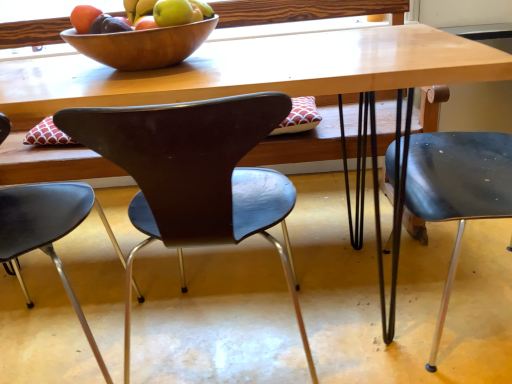
Locate an element on the screen. This screenshot has height=384, width=512. wooden bowl at upper center is located at coordinates click(142, 45).

Describe the element at coordinates (458, 189) in the screenshot. I see `matte black chair at right, acting as the 1th chair starting from the right` at that location.

The image size is (512, 384). In order to click on matte brown chair at center, marked as the 2th chair in a left-to-right arrangement in this screenshot , I will do `click(194, 175)`.

Looking at their sizes, would you say matte brown chair at center, the 2th chair in the right-to-left sequence, is wider or thinner than matte black chair at right, acting as the 1th chair starting from the right?

Clearly, matte brown chair at center, the 2th chair in the right-to-left sequence, has less width compared to matte black chair at right, acting as the 1th chair starting from the right.

Is point (126, 360) more distant than point (428, 137)?

No.

Starting from the matte black chair at right, the 3th chair from the left, which chair is the 1st one in front? Please provide its 2D coordinates.

[(194, 175)]

Is wooden bowl at upper center outside of matte black chair at center, the first chair in the left-to-right sequence?

That's correct, wooden bowl at upper center is outside of matte black chair at center, the first chair in the left-to-right sequence.

Who is bigger, wooden bowl at upper center or matte black chair at center, placed as the 3th chair when sorted from right to left?

matte black chair at center, placed as the 3th chair when sorted from right to left, is bigger.

Is the position of wooden bowl at upper center less distant than that of matte black chair at center, the first chair in the left-to-right sequence?

No, wooden bowl at upper center is further to the viewer.

Which is closer to the camera, (128, 55) or (62, 227)?

Clearly, point (128, 55) is closer to the camera than point (62, 227).

From the image's perspective, which chair is the 2nd one below the matte black chair at right, acting as the 1th chair starting from the right? Please provide its 2D coordinates.

[(48, 232)]

Does point (77, 201) appear closer or farther from the camera than point (419, 176)?

Point (77, 201) appears to be closer to the viewer than point (419, 176).

Based on the photo, considering the positions of objects matte black chair at center, the first chair in the left-to-right sequence, and matte black chair at right, acting as the 1th chair starting from the right, in the image provided, who is more to the right, matte black chair at center, the first chair in the left-to-right sequence, or matte black chair at right, acting as the 1th chair starting from the right,?

matte black chair at right, acting as the 1th chair starting from the right.

Considering the sizes of objects matte black chair at center, the first chair in the left-to-right sequence, and matte black chair at right, the 3th chair from the left, in the image provided, who is wider, matte black chair at center, the first chair in the left-to-right sequence, or matte black chair at right, the 3th chair from the left,?

matte black chair at right, the 3th chair from the left, is wider.

From the picture: Is matte brown chair at center, marked as the 2th chair in a left-to-right arrangement, looking in the opposite direction of wooden bowl at upper center?

No.

What's the angular difference between matte brown chair at center, the 2th chair in the right-to-left sequence, and wooden bowl at upper center's facing directions?

matte brown chair at center, the 2th chair in the right-to-left sequence, and wooden bowl at upper center are facing 176 degrees away from each other.

From the image's perspective, which is above, matte brown chair at center, the 2th chair in the right-to-left sequence, or wooden bowl at upper center?

wooden bowl at upper center is shown above in the image.

Is matte brown chair at center, the 2th chair in the right-to-left sequence, far away from wooden bowl at upper center?

matte brown chair at center, the 2th chair in the right-to-left sequence, is actually quite close to wooden bowl at upper center.

From the image's perspective, is matte black chair at center, the first chair in the left-to-right sequence, beneath wooden bowl at upper center?

Yes, from the image's perspective, matte black chair at center, the first chair in the left-to-right sequence, is beneath wooden bowl at upper center.

Based on the photo, is matte black chair at center, the first chair in the left-to-right sequence, oriented away from wooden bowl at upper center?

That's not correct — matte black chair at center, the first chair in the left-to-right sequence, is not looking away from wooden bowl at upper center.

Where is `bowl above the matte black chair at center, the first chair in the left-to-right sequence (from the image's perspective)`? bowl above the matte black chair at center, the first chair in the left-to-right sequence (from the image's perspective) is located at coordinates (x=142, y=45).

What's the angular difference between matte black chair at center, the first chair in the left-to-right sequence, and wooden bowl at upper center's facing directions?

176 degrees separate the facing orientations of matte black chair at center, the first chair in the left-to-right sequence, and wooden bowl at upper center.

Based on the photo, could you tell me if matte black chair at right, the 3th chair from the left, is turned towards matte black chair at center, placed as the 3th chair when sorted from right to left?

Yes, matte black chair at right, the 3th chair from the left, is turned towards matte black chair at center, placed as the 3th chair when sorted from right to left.

Is matte black chair at center, placed as the 3th chair when sorted from right to left, completely or partially inside matte black chair at right, acting as the 1th chair starting from the right?

No, matte black chair at center, placed as the 3th chair when sorted from right to left, is located outside of matte black chair at right, acting as the 1th chair starting from the right.

Looking at their sizes, would you say matte black chair at right, the 3th chair from the left, is wider or thinner than matte black chair at center, the first chair in the left-to-right sequence?

Considering their sizes, matte black chair at right, the 3th chair from the left, looks broader than matte black chair at center, the first chair in the left-to-right sequence.

From the image's perspective, between wooden bowl at upper center and matte black chair at right, the 3th chair from the left, who is located below?

matte black chair at right, the 3th chair from the left.

From the wooden bowl at upper center, count 2nd chair to the right and point to it. Please provide its 2D coordinates.

[(458, 189)]

Is wooden bowl at upper center behind matte black chair at right, the 3th chair from the left?

Yes, it is behind matte black chair at right, the 3th chair from the left.

Is wooden bowl at upper center wider than matte black chair at right, the 3th chair from the left?

In fact, wooden bowl at upper center might be narrower than matte black chair at right, the 3th chair from the left.

I want to click on chair lying on the right of matte brown chair at center, marked as the 2th chair in a left-to-right arrangement, so click(458, 189).

The width and height of the screenshot is (512, 384). Find the location of `bowl above the matte black chair at center, the first chair in the left-to-right sequence (from a real-world perspective)`. bowl above the matte black chair at center, the first chair in the left-to-right sequence (from a real-world perspective) is located at coordinates (142, 45).

Estimate the real-world distances between objects in this image. Which object is further from matte black chair at right, acting as the 1th chair starting from the right, matte black chair at center, placed as the 3th chair when sorted from right to left, or matte brown chair at center, marked as the 2th chair in a left-to-right arrangement?

matte black chair at center, placed as the 3th chair when sorted from right to left.

Looking at the image, which one is located closer to matte brown chair at center, marked as the 2th chair in a left-to-right arrangement, matte black chair at center, placed as the 3th chair when sorted from right to left, or matte black chair at right, the 3th chair from the left?

matte black chair at center, placed as the 3th chair when sorted from right to left.

Looking at the image, which one is located further to matte brown chair at center, marked as the 2th chair in a left-to-right arrangement, matte black chair at right, the 3th chair from the left, or wooden bowl at upper center?

Among the two, matte black chair at right, the 3th chair from the left, is located further to matte brown chair at center, marked as the 2th chair in a left-to-right arrangement.

Based on their spatial positions, is matte black chair at right, acting as the 1th chair starting from the right, or matte black chair at center, placed as the 3th chair when sorted from right to left, closer to matte brown chair at center, the 2th chair in the right-to-left sequence?

Among the two, matte black chair at center, placed as the 3th chair when sorted from right to left, is located nearer to matte brown chair at center, the 2th chair in the right-to-left sequence.

Based on their spatial positions, is matte black chair at center, placed as the 3th chair when sorted from right to left, or wooden bowl at upper center closer to matte black chair at right, the 3th chair from the left?

wooden bowl at upper center is positioned closer to the anchor matte black chair at right, the 3th chair from the left.

Estimate the real-world distances between objects in this image. Which object is closer to wooden bowl at upper center, matte brown chair at center, marked as the 2th chair in a left-to-right arrangement, or matte black chair at right, the 3th chair from the left?

matte brown chair at center, marked as the 2th chair in a left-to-right arrangement, lies closer to wooden bowl at upper center than the other object.

When comparing their distances from matte brown chair at center, the 2th chair in the right-to-left sequence, does matte black chair at center, the first chair in the left-to-right sequence, or wooden bowl at upper center seem closer?

The object closer to matte brown chair at center, the 2th chair in the right-to-left sequence, is matte black chair at center, the first chair in the left-to-right sequence.

Based on their spatial positions, is matte brown chair at center, the 2th chair in the right-to-left sequence, or wooden bowl at upper center further from matte black chair at center, the first chair in the left-to-right sequence?

wooden bowl at upper center is further to matte black chair at center, the first chair in the left-to-right sequence.

At what (x,y) coordinates should I click in order to perform the action: click on bowl between matte black chair at center, the first chair in the left-to-right sequence, and matte black chair at right, the 3th chair from the left, in the horizontal direction. Please return your answer as a coordinate pair (x, y). The width and height of the screenshot is (512, 384). Looking at the image, I should click on (142, 45).

At what (x,y) coordinates should I click in order to perform the action: click on chair situated between matte black chair at center, the first chair in the left-to-right sequence, and matte black chair at right, acting as the 1th chair starting from the right, from left to right. Please return your answer as a coordinate pair (x, y). The height and width of the screenshot is (384, 512). Looking at the image, I should click on (194, 175).

Where is `chair between wooden bowl at upper center and matte black chair at right, the 3th chair from the left`? chair between wooden bowl at upper center and matte black chair at right, the 3th chair from the left is located at coordinates (194, 175).